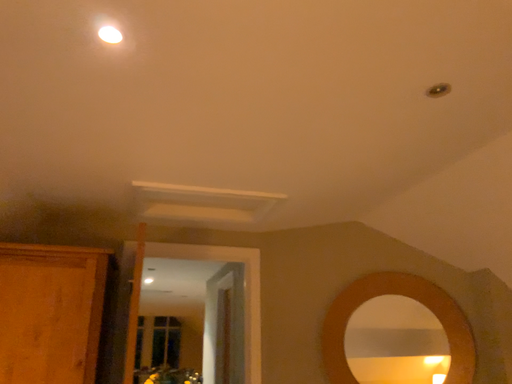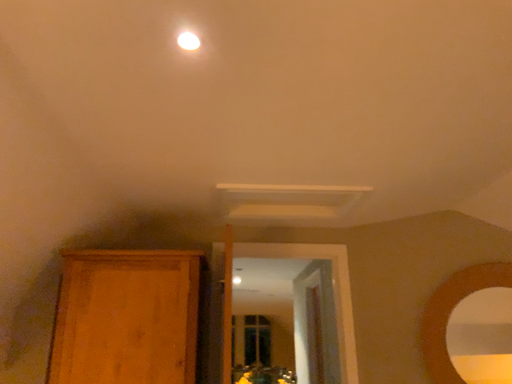
Question: Which way did the camera rotate in the video?

Choices:
 (A) rotated left
 (B) rotated right

Answer: (A)